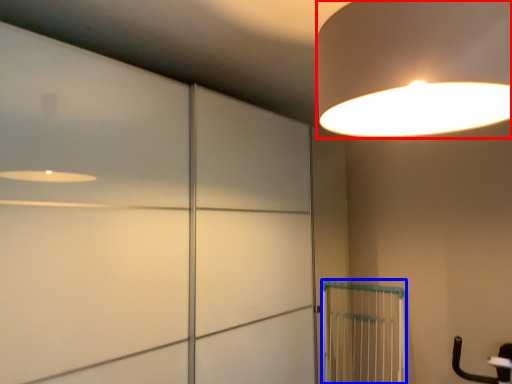
Question: Which of the following is the closest to the observer, lamp (highlighted by a red box) or cage (highlighted by a blue box)?

Choices:
 (A) lamp
 (B) cage

Answer: (A)